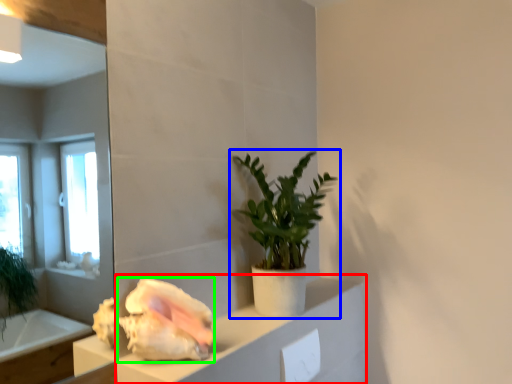
Question: Estimate the real-world distances between objects in this image. Which object is closer to cabinetry (highlighted by a red box), houseplant (highlighted by a blue box) or flower (highlighted by a green box)?

Choices:
 (A) houseplant
 (B) flower

Answer: (B)